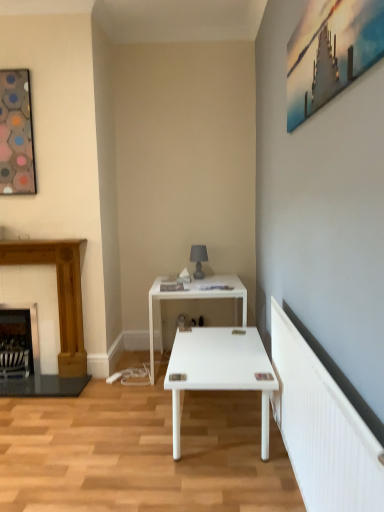
Question: From a real-world perspective, is wooden fireplace at left, acting as the first fireplace starting from the right, physically above dark wood fireplace at left, acting as the 1th fireplace starting from the left?

Choices:
 (A) yes
 (B) no

Answer: (A)

Question: Is wooden fireplace at left, acting as the first fireplace starting from the right, taller than dark wood fireplace at left, which is the second fireplace from right to left?

Choices:
 (A) no
 (B) yes

Answer: (B)

Question: Does wooden fireplace at left, arranged as the 2th fireplace when viewed from the left, come in front of dark wood fireplace at left, which is the second fireplace from right to left?

Choices:
 (A) no
 (B) yes

Answer: (B)

Question: Considering the relative sizes of wooden fireplace at left, acting as the first fireplace starting from the right, and dark wood fireplace at left, acting as the 1th fireplace starting from the left, in the image provided, is wooden fireplace at left, acting as the first fireplace starting from the right, smaller than dark wood fireplace at left, acting as the 1th fireplace starting from the left,?

Choices:
 (A) yes
 (B) no

Answer: (B)

Question: Considering the relative positions of wooden fireplace at left, acting as the first fireplace starting from the right, and dark wood fireplace at left, acting as the 1th fireplace starting from the left, in the image provided, is wooden fireplace at left, acting as the first fireplace starting from the right, to the right of dark wood fireplace at left, acting as the 1th fireplace starting from the left, from the viewer's perspective?

Choices:
 (A) yes
 (B) no

Answer: (A)

Question: Considering the positions of matte gray table lamp at center and metallic silver painting at upper right, the 1th picture frame from the right, in the image, is matte gray table lamp at center bigger or smaller than metallic silver painting at upper right, the 1th picture frame from the right,?

Choices:
 (A) big
 (B) small

Answer: (B)

Question: From a real-world perspective, relative to metallic silver painting at upper right, the second picture frame from the back, is matte gray table lamp at center vertically above or below?

Choices:
 (A) above
 (B) below

Answer: (B)

Question: Considering the positions of matte gray table lamp at center and metallic silver painting at upper right, the second picture frame from the back, in the image, is matte gray table lamp at center taller or shorter than metallic silver painting at upper right, the second picture frame from the back,?

Choices:
 (A) tall
 (B) short

Answer: (B)

Question: From the image's perspective, is matte gray table lamp at center located above or below metallic silver painting at upper right, the 1th picture frame from the right?

Choices:
 (A) below
 (B) above

Answer: (A)

Question: Would you say dark wood fireplace at left, acting as the 1th fireplace starting from the left, is inside or outside matte gray table lamp at center?

Choices:
 (A) inside
 (B) outside

Answer: (B)

Question: Considering the positions of dark wood fireplace at left, acting as the 1th fireplace starting from the left, and matte gray table lamp at center in the image, is dark wood fireplace at left, acting as the 1th fireplace starting from the left, wider or thinner than matte gray table lamp at center?

Choices:
 (A) wide
 (B) thin

Answer: (A)

Question: Considering the positions of dark wood fireplace at left, which is the second fireplace from right to left, and matte gray table lamp at center in the image, is dark wood fireplace at left, which is the second fireplace from right to left, bigger or smaller than matte gray table lamp at center?

Choices:
 (A) big
 (B) small

Answer: (A)

Question: Is point (19, 316) positioned closer to the camera than point (200, 278)?

Choices:
 (A) closer
 (B) farther

Answer: (A)

Question: From a real-world perspective, is metallic silver painting at upper right, the 1th picture frame from the right, positioned above or below wooden fireplace at left, acting as the first fireplace starting from the right?

Choices:
 (A) above
 (B) below

Answer: (A)

Question: In terms of width, does metallic silver painting at upper right, marked as the first picture frame in a front-to-back arrangement, look wider or thinner when compared to wooden fireplace at left, acting as the first fireplace starting from the right?

Choices:
 (A) thin
 (B) wide

Answer: (A)